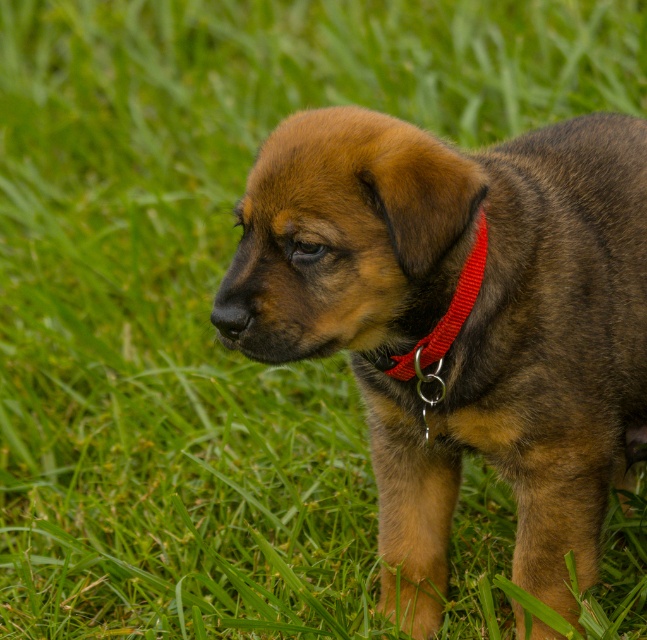
Consider the image. You are a dog trainer standing 1.65 meters away from the brown fur dog at center. Can you safely approach the dog without using any treats or toys to entice it?

The brown fur dog at center and viewer are 1.65 meters apart. Since the distance is within a safe range for approaching a calm and curious puppy, you can cautiously approach the dog while maintaining awareness of its body language.

You are a photographer trying to capture the brown fur dog at center and the red nylon collar at center in a single shot. Based on their sizes, which one should you focus on to ensure both are clearly visible in the frame?

The brown fur dog at center is bigger than the red nylon collar at center, so focusing on the brown fur dog at center will ensure both are clearly visible in the frame.

You are a photographer trying to capture the brown fur dog at center and the red nylon collar at center in a single shot. Which object should you focus on first to ensure both are in focus?

The brown fur dog at center is in front of the red nylon collar at center, so you should focus on the brown fur dog at center first to ensure both are in focus.